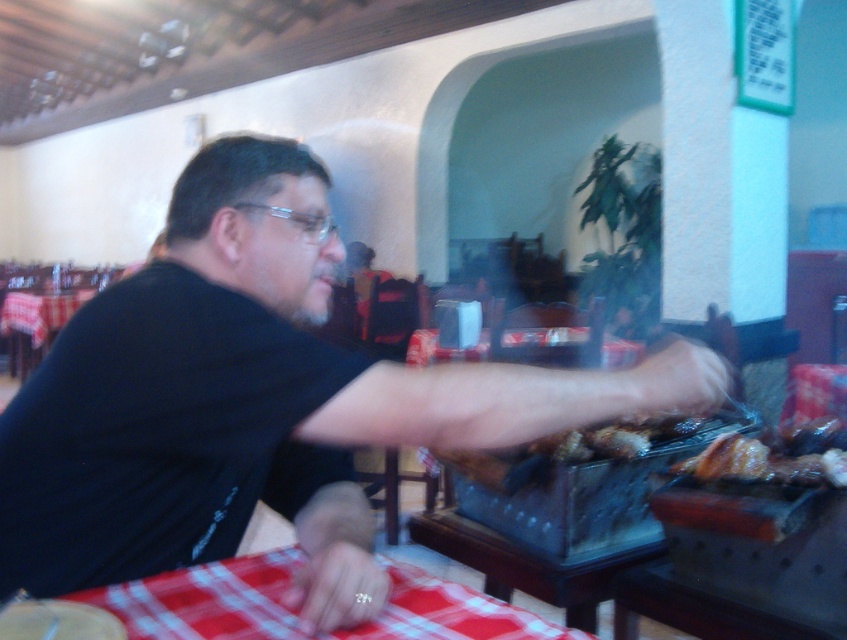
You are a customer at this dining establishment and you want to place the brown crispy chicken at center on the red checkered tablecloth at left. Based on their sizes, will the chicken fit on the tablecloth?

The brown crispy chicken at center occupies less space than the red checktered tablecloth at left, so yes, the chicken will fit on the tablecloth.

You are a waiter in the dining establishment and need to place a drink order. Which object, the black matte shirt at center or the transparent plastic glasses at center, is positioned higher up in the scene?

The black matte shirt at center is taller than the transparent plastic glasses at center, so the black matte shirt at center is positioned higher up in the scene.